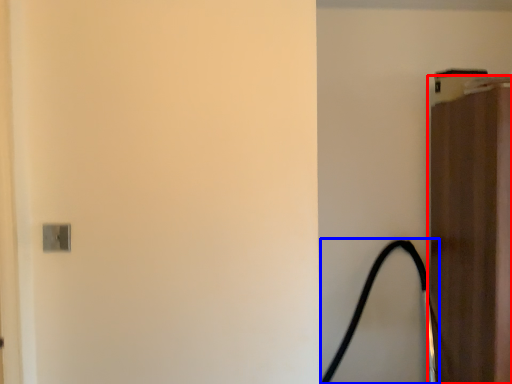
Question: Which object is further to the camera taking this photo, door (highlighted by a red box) or garden hose (highlighted by a blue box)?

Choices:
 (A) door
 (B) garden hose

Answer: (B)